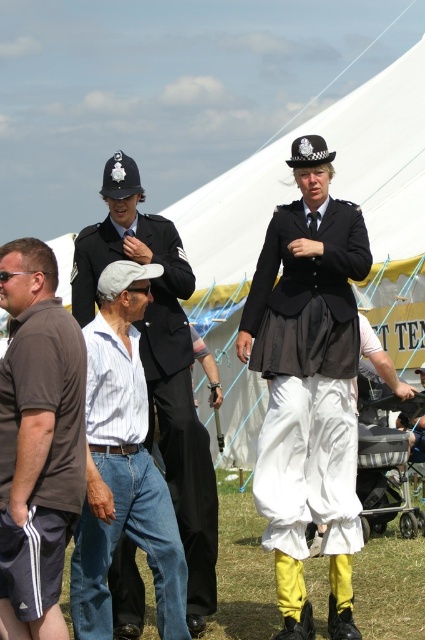
Does black satin skirt at center appear on the right side of black fabric uniform at center?

Indeed, black satin skirt at center is positioned on the right side of black fabric uniform at center.

How much distance is there between black satin skirt at center and black fabric uniform at center?

8.50 feet

Locate an element on the screen. The image size is (425, 640). black satin skirt at center is located at coordinates pyautogui.click(x=306, y=358).

Consider the image. Is brown cotton shirt at lower left positioned behind black fabric uniform at center?

That is False.

The width and height of the screenshot is (425, 640). In order to click on brown cotton shirt at lower left in this screenshot , I will do pyautogui.click(x=37, y=433).

Identify the location of brown cotton shirt at lower left. (37, 433).

Is black satin skirt at center positioned before brown cotton shirt at lower left?

No, black satin skirt at center is behind brown cotton shirt at lower left.

Measure the distance between black satin skirt at center and brown cotton shirt at lower left.

A distance of 15.99 feet exists between black satin skirt at center and brown cotton shirt at lower left.

Is point (337, 204) farther from viewer compared to point (48, 246)?

Yes, it is behind point (48, 246).

This screenshot has height=640, width=425. I want to click on black satin skirt at center, so click(x=306, y=358).